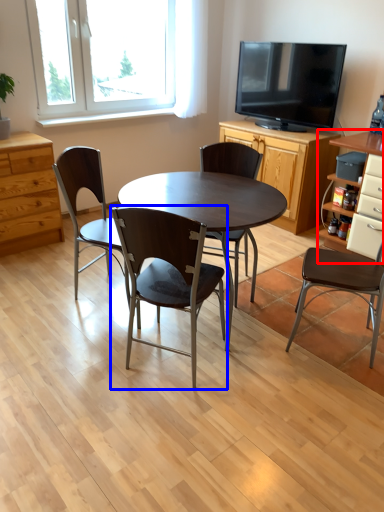
Question: Among these objects, which one is nearest to the camera, cabinetry (highlighted by a red box) or chair (highlighted by a blue box)?

Choices:
 (A) cabinetry
 (B) chair

Answer: (B)